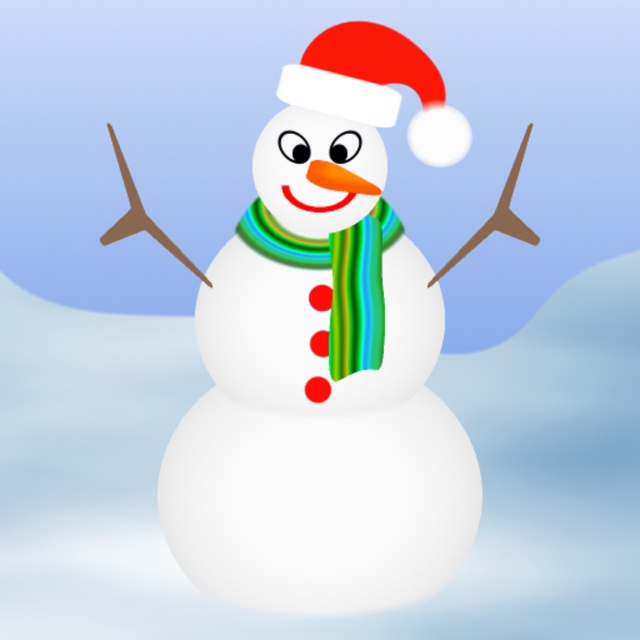
Can you confirm if white matte snowman at center is positioned to the left of matte red santa hat at upper center?

Yes, white matte snowman at center is to the left of matte red santa hat at upper center.

Image resolution: width=640 pixels, height=640 pixels. What are the coordinates of `white matte snowman at center` in the screenshot? It's located at (320, 403).

Who is more forward, (442, 90) or (340, 326)?

Point (340, 326) is in front.

Locate an element on the screen. matte red santa hat at upper center is located at coordinates (376, 86).

Does white matte snowman at center appear over green striped scarf at center?

No.

You are a GUI agent. You are given a task and a screenshot of the screen. Output one action in this format:
    pyautogui.click(x=<x>, y=<y>)
    Task: Click on the white matte snowman at center
    
    Given the screenshot: What is the action you would take?
    pyautogui.click(x=320, y=403)

The width and height of the screenshot is (640, 640). Identify the location of white matte snowman at center. (320, 403).